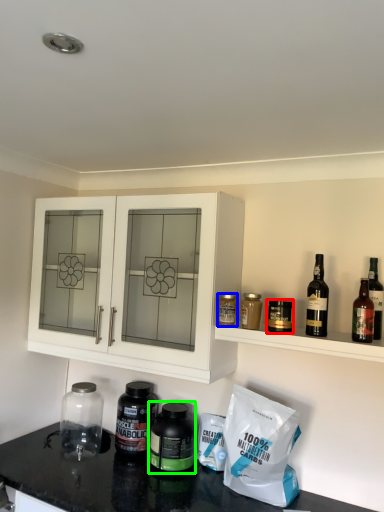
Question: Considering the real-world distances, which object is closest to bottle (highlighted by a red box)? bottle (highlighted by a blue box) or bottle (highlighted by a green box).

Choices:
 (A) bottle
 (B) bottle

Answer: (A)